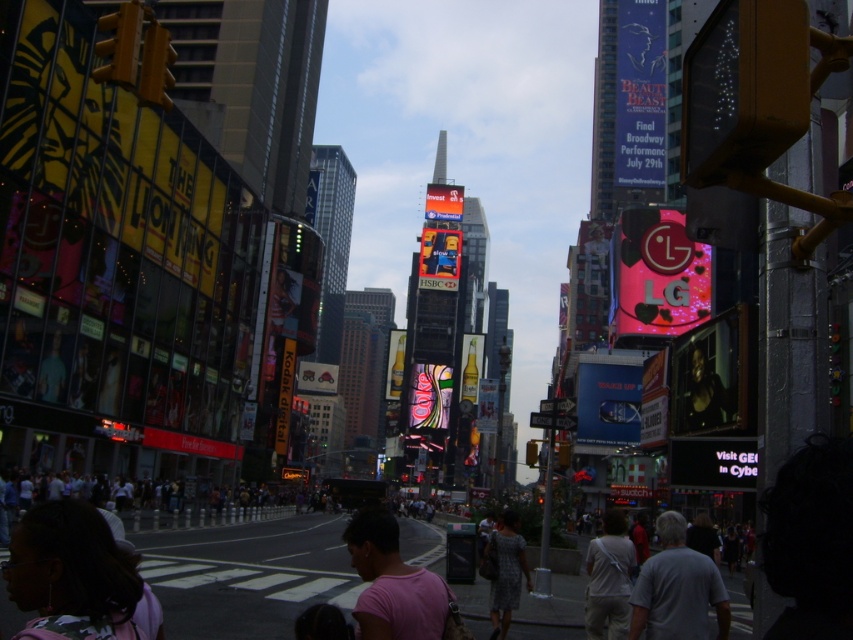
Question: Is dark pink fabric at lower left bigger than dark gray shirt at center?

Choices:
 (A) yes
 (B) no

Answer: (B)

Question: Can you confirm if pink cotton shirt at center is smaller than printed fabric dress at center?

Choices:
 (A) no
 (B) yes

Answer: (A)

Question: Which object appears farthest from the camera in this image?

Choices:
 (A) pink cotton shirt at center
 (B) gray cotton shirt at center
 (C) white fabric bag at center

Answer: (C)

Question: Which object appears farthest from the camera in this image?

Choices:
 (A) white fabric bag at center
 (B) gray cotton shirt at center
 (C) dark pink fabric at lower left
 (D) pink cotton shirt at center

Answer: (A)

Question: Does dark pink fabric at lower left appear on the left side of printed fabric dress at center?

Choices:
 (A) no
 (B) yes

Answer: (B)

Question: Which object appears farthest from the camera in this image?

Choices:
 (A) pink cotton shirt at center
 (B) gray cotton shirt at center
 (C) printed fabric dress at center

Answer: (C)